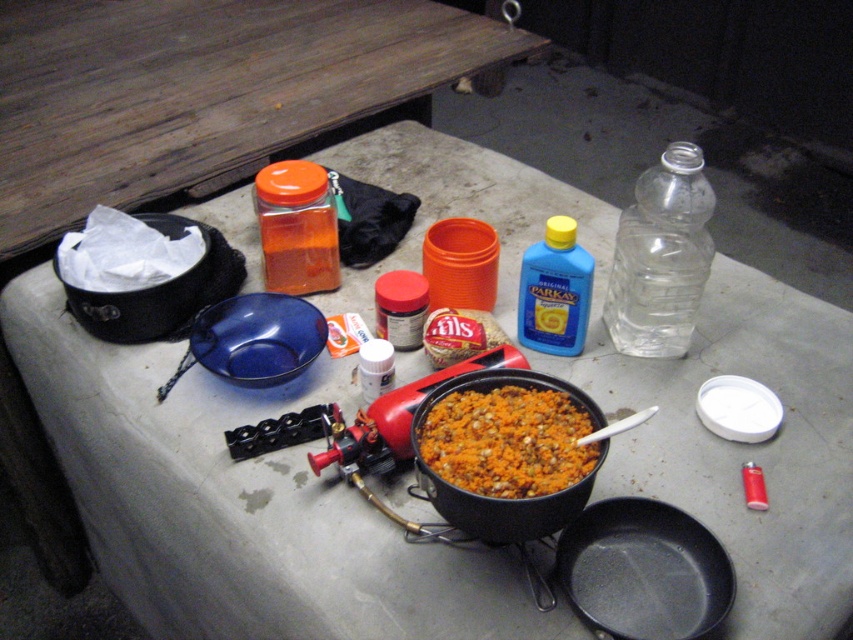
Which of these two, brown matte pot at center or blue plastic bottle at center, stands taller?

blue plastic bottle at center is taller.

Is brown matte pot at center shorter than blue plastic bottle at center?

Yes, brown matte pot at center is shorter than blue plastic bottle at center.

Is point (584, 417) less distant than point (523, 310)?

Yes, it is.

Locate an element on the screen. This screenshot has width=853, height=640. brown matte pot at center is located at coordinates (508, 442).

Is black non-stick frying pan at lower center below transparent plastic bottle at upper right?

Yes, black non-stick frying pan at lower center is below transparent plastic bottle at upper right.

Locate an element on the screen. The height and width of the screenshot is (640, 853). black non-stick frying pan at lower center is located at coordinates click(x=643, y=570).

Is point (648, 506) less distant than point (654, 300)?

That is True.

Image resolution: width=853 pixels, height=640 pixels. In order to click on black non-stick frying pan at lower center in this screenshot , I will do `click(643, 570)`.

Who is shorter, orange matte jar at center or blue plastic bottle at center?

Standing shorter between the two is blue plastic bottle at center.

Who is more forward, (x=270, y=291) or (x=581, y=260)?

Point (x=581, y=260)

The width and height of the screenshot is (853, 640). I want to click on orange matte jar at center, so click(296, 227).